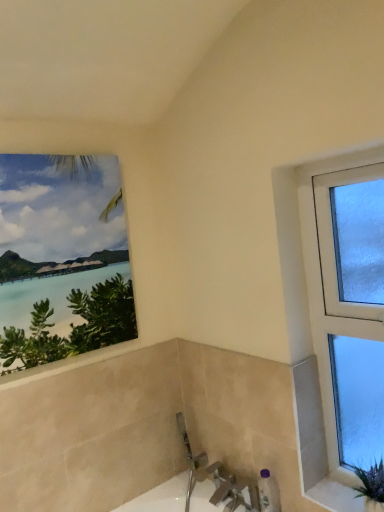
Question: Is matte canvas painting at upper left, which appears as the 2th window when viewed from the right, smaller than purple plastic bottle at lower right?

Choices:
 (A) no
 (B) yes

Answer: (A)

Question: Is matte canvas painting at upper left, which appears as the 2th window when viewed from the right, facing away from purple plastic bottle at lower right?

Choices:
 (A) yes
 (B) no

Answer: (B)

Question: From the image's perspective, does matte canvas painting at upper left, which is the first window from left to right, appear higher than purple plastic bottle at lower right?

Choices:
 (A) yes
 (B) no

Answer: (A)

Question: Is matte canvas painting at upper left, which appears as the 2th window when viewed from the right, in front of purple plastic bottle at lower right?

Choices:
 (A) yes
 (B) no

Answer: (A)

Question: From a real-world perspective, is matte canvas painting at upper left, which is the first window from left to right, located beneath purple plastic bottle at lower right?

Choices:
 (A) no
 (B) yes

Answer: (A)

Question: Can you confirm if matte canvas painting at upper left, which is the first window from left to right, is positioned to the right of purple plastic bottle at lower right?

Choices:
 (A) yes
 (B) no

Answer: (B)

Question: Is purple plastic bottle at lower right closer to camera compared to clear glass window at right, which appears as the first window when viewed from the right?

Choices:
 (A) yes
 (B) no

Answer: (B)

Question: Considering the relative positions of purple plastic bottle at lower right and clear glass window at right, which appears as the first window when viewed from the right, in the image provided, is purple plastic bottle at lower right to the right of clear glass window at right, which appears as the first window when viewed from the right, from the viewer's perspective?

Choices:
 (A) yes
 (B) no

Answer: (B)

Question: Considering the relative positions of purple plastic bottle at lower right and clear glass window at right, which is the 2th window in left-to-right order, in the image provided, is purple plastic bottle at lower right behind clear glass window at right, which is the 2th window in left-to-right order,?

Choices:
 (A) yes
 (B) no

Answer: (A)

Question: Considering the relative positions of purple plastic bottle at lower right and clear glass window at right, which is the 2th window in left-to-right order, in the image provided, is purple plastic bottle at lower right to the left of clear glass window at right, which is the 2th window in left-to-right order, from the viewer's perspective?

Choices:
 (A) no
 (B) yes

Answer: (B)

Question: Does purple plastic bottle at lower right have a lesser width compared to clear glass window at right, which is the 2th window in left-to-right order?

Choices:
 (A) no
 (B) yes

Answer: (B)

Question: Is purple plastic bottle at lower right located outside clear glass window at right, which appears as the first window when viewed from the right?

Choices:
 (A) no
 (B) yes

Answer: (B)

Question: From a real-world perspective, is purple plastic bottle at lower right located higher than white textured stone at lower right?

Choices:
 (A) no
 (B) yes

Answer: (A)